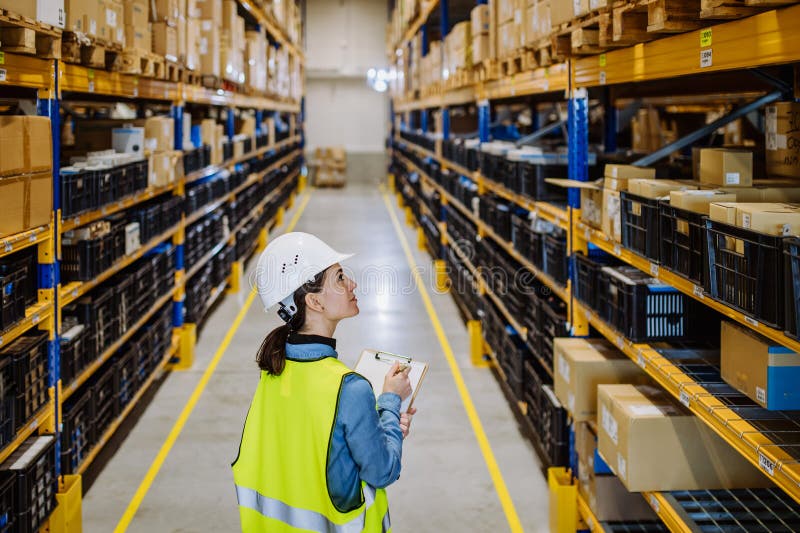
Locate an element on the screen. The image size is (800, 533). 6th level storage racks is located at coordinates (249, 8), (265, 25), (276, 38), (286, 47), (298, 56), (429, 7), (418, 24), (406, 28), (401, 36), (390, 51).